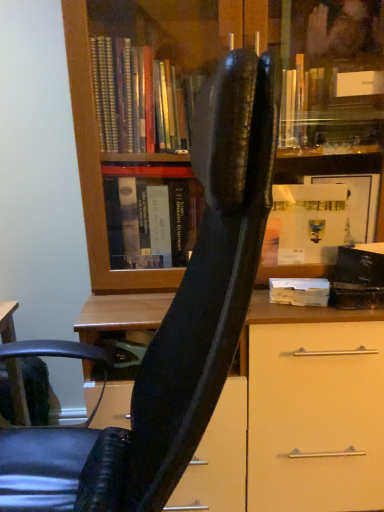
Find the location of a particular element. black leather chair at center is located at coordinates (173, 322).

Describe the element at coordinates (173, 322) in the screenshot. I see `black leather chair at center` at that location.

Measure the distance between black leather chair at center and camera.

The depth of black leather chair at center is 15.24 inches.

The image size is (384, 512). Describe the element at coordinates (299, 291) in the screenshot. I see `wooden block at center` at that location.

At what (x,y) coordinates should I click in order to perform the action: click on wooden block at center. Please return your answer as a coordinate pair (x, y). This screenshot has height=512, width=384. Looking at the image, I should click on (299, 291).

Identify the location of black leather chair at center. (173, 322).

Between black leather chair at center and wooden block at center, which one appears on the left side from the viewer's perspective?

black leather chair at center is more to the left.

Is the depth of black leather chair at center less than that of wooden block at center?

Yes, black leather chair at center is in front of wooden block at center.

Which is farther, (231, 114) or (279, 284)?

The point (279, 284) is farther.

From the image's perspective, is black leather chair at center located beneath wooden block at center?

Indeed, from the image's perspective, black leather chair at center is shown beneath wooden block at center.

From a real-world perspective, is black leather chair at center physically above wooden block at center?

No, from a real-world perspective, black leather chair at center is not above wooden block at center.

Looking at their sizes, would you say black leather chair at center is wider or thinner than wooden block at center?

Clearly, black leather chair at center has more width compared to wooden block at center.

Does black leather chair at center have a greater height compared to wooden block at center?

Correct, black leather chair at center is much taller as wooden block at center.

Who is smaller, black leather chair at center or wooden block at center?

Smaller between the two is wooden block at center.

From the picture: Does black leather chair at center contain wooden block at center?

No, wooden block at center is not surrounded by black leather chair at center.

Is black leather chair at center positioned far away from wooden block at center?

No, black leather chair at center is in close proximity to wooden block at center.

Is black leather chair at center positioned with its back to wooden block at center?

No.

What's the angular difference between black leather chair at center and wooden block at center's facing directions?

81.9 degrees.

How far apart are black leather chair at center and wooden block at center?

black leather chair at center is 22.80 inches from wooden block at center.

Identify the location of book lying above the black leather chair at center (from the image's perspective). The image size is (384, 512). (299, 291).

Consider the image. Based on their positions, is wooden block at center located to the left or right of black leather chair at center?

In the image, wooden block at center appears on the right side of black leather chair at center.

Which is in front, wooden block at center or black leather chair at center?

black leather chair at center is in front.

Does point (274, 291) come in front of point (194, 271)?

No, (274, 291) is behind (194, 271).

From the image's perspective, between wooden block at center and black leather chair at center, which one is located above?

wooden block at center, from the image's perspective.

From a real-world perspective, is wooden block at center over black leather chair at center?

Yes.

Looking at this image, between wooden block at center and black leather chair at center, which one has smaller width?

wooden block at center is thinner.

Does wooden block at center have a greater height compared to black leather chair at center?

No, wooden block at center is not taller than black leather chair at center.

Considering the relative sizes of wooden block at center and black leather chair at center in the image provided, is wooden block at center bigger than black leather chair at center?

No.

Would you say black leather chair at center is part of wooden block at center's contents?

No, black leather chair at center is not surrounded by wooden block at center.

From the picture: Is wooden block at center directly adjacent to black leather chair at center?

No, wooden block at center is not in contact with black leather chair at center.

Could you tell me if wooden block at center is turned towards black leather chair at center?

No, wooden block at center is not turned towards black leather chair at center.

Find the location of a particular element. This screenshot has height=512, width=384. book above the black leather chair at center (from the image's perspective) is located at coordinates (299, 291).

Find the location of a particular element. The width and height of the screenshot is (384, 512). book above the black leather chair at center (from a real-world perspective) is located at coordinates (299, 291).

In order to click on chair located underneath the wooden block at center (from a real-world perspective) in this screenshot , I will do `click(173, 322)`.